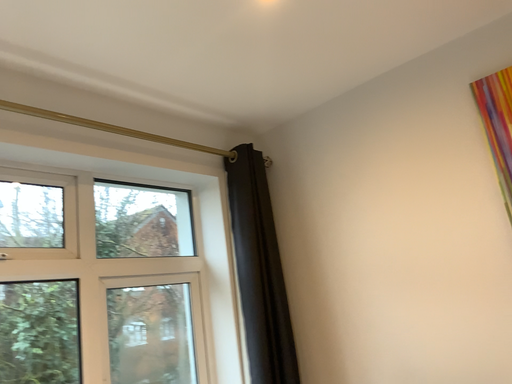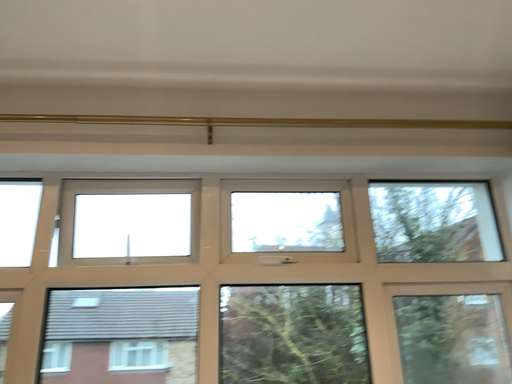
Question: Which way did the camera rotate in the video?

Choices:
 (A) rotated right
 (B) rotated left

Answer: (B)